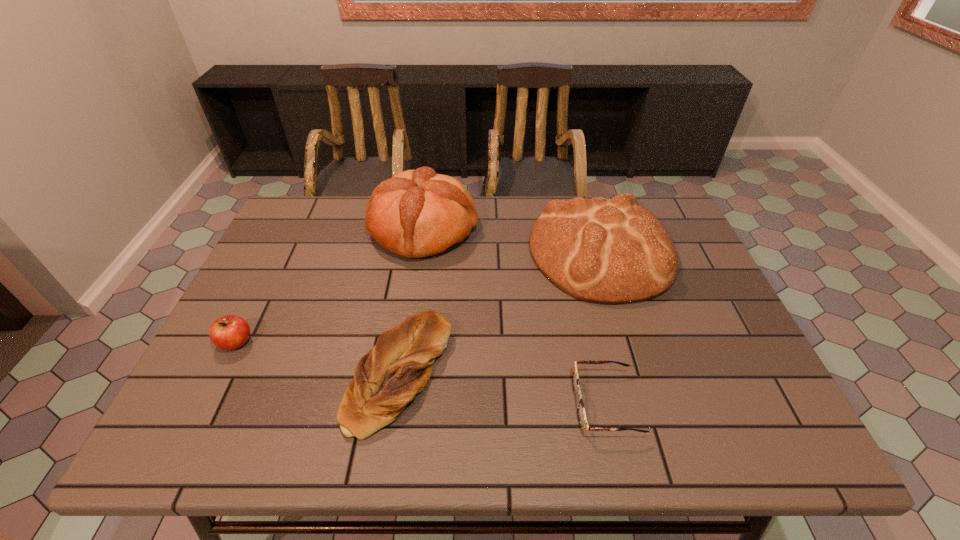
In the image, there is a desktop. At what (x,y) coordinates should I click in order to perform the action: click on vacant space at the far right corner. Please return your answer as a coordinate pair (x, y). The image size is (960, 540). Looking at the image, I should click on (641, 206).

This screenshot has width=960, height=540. I want to click on vacant area between the leftmost object and the rightmost bread, so click(x=419, y=298).

Image resolution: width=960 pixels, height=540 pixels. Identify the location of empty space between the apple and the rightmost bread. [x=419, y=298].

Locate an element on the screen. free space between the rightmost bread and the leftmost object is located at coordinates (419, 298).

You are a GUI agent. You are given a task and a screenshot of the screen. Output one action in this format:
    pyautogui.click(x=<x>, y=<y>)
    Task: Click on the vacant space that's between the rightmost bread and the leftmost object
    The image size is (960, 540).
    Given the screenshot: What is the action you would take?
    pyautogui.click(x=419, y=298)

Locate an element on the screen. This screenshot has width=960, height=540. vacant point located between the nearest bread and the apple is located at coordinates (318, 358).

Where is `object that is the fourth closest to the second shortest object`? object that is the fourth closest to the second shortest object is located at coordinates (581, 413).

Locate which object is the closest to the apple. Please provide its 2D coordinates. Your answer should be formatted as a tuple, i.e. [(x, y)], where the tuple contains the x and y coordinates of a point satisfying the conditions above.

[(399, 366)]

Identify which bread is located as the nearest to the shortest object. Please provide its 2D coordinates. Your answer should be formatted as a tuple, i.e. [(x, y)], where the tuple contains the x and y coordinates of a point satisfying the conditions above.

[(612, 251)]

Identify which bread is the third closest to the spectacles. Please provide its 2D coordinates. Your answer should be formatted as a tuple, i.e. [(x, y)], where the tuple contains the x and y coordinates of a point satisfying the conditions above.

[(417, 213)]